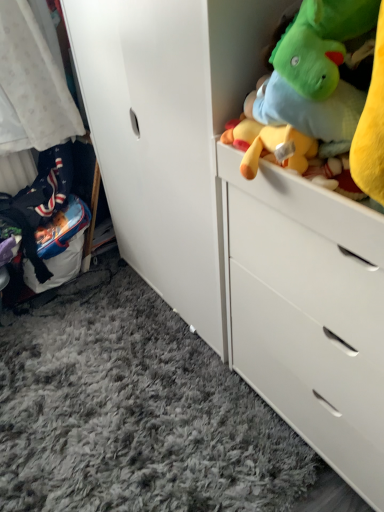
Question: Is white soft fabric at left positioned in front of white matte chest of drawers at upper right?

Choices:
 (A) no
 (B) yes

Answer: (A)

Question: Is white soft fabric at left to the right of white matte chest of drawers at upper right from the viewer's perspective?

Choices:
 (A) no
 (B) yes

Answer: (A)

Question: Considering the relative sizes of white soft fabric at left and white matte chest of drawers at upper right in the image provided, is white soft fabric at left wider than white matte chest of drawers at upper right?

Choices:
 (A) yes
 (B) no

Answer: (B)

Question: Can you confirm if white soft fabric at left is bigger than white matte chest of drawers at upper right?

Choices:
 (A) no
 (B) yes

Answer: (A)

Question: Is white soft fabric at left smaller than white matte chest of drawers at upper right?

Choices:
 (A) no
 (B) yes

Answer: (B)

Question: From a real-world perspective, relative to white matte chest of drawers at upper right, is soft plush toys at upper right vertically above or below?

Choices:
 (A) above
 (B) below

Answer: (A)

Question: Is point (362, 154) positioned closer to the camera than point (261, 391)?

Choices:
 (A) closer
 (B) farther

Answer: (A)

Question: Considering the positions of soft plush toys at upper right and white matte chest of drawers at upper right in the image, is soft plush toys at upper right taller or shorter than white matte chest of drawers at upper right?

Choices:
 (A) tall
 (B) short

Answer: (B)

Question: Is soft plush toys at upper right spatially inside white matte chest of drawers at upper right, or outside of it?

Choices:
 (A) inside
 (B) outside

Answer: (B)

Question: Is soft plush toys at upper right spatially inside white soft fabric at left, or outside of it?

Choices:
 (A) inside
 (B) outside

Answer: (B)

Question: Is point (299, 61) closer or farther from the camera than point (1, 150)?

Choices:
 (A) closer
 (B) farther

Answer: (A)

Question: Looking at the image, does soft plush toys at upper right seem bigger or smaller compared to white soft fabric at left?

Choices:
 (A) big
 (B) small

Answer: (A)

Question: From a real-world perspective, is soft plush toys at upper right above or below white soft fabric at left?

Choices:
 (A) above
 (B) below

Answer: (A)

Question: Based on their sizes in the image, would you say white matte chest of drawers at upper right is bigger or smaller than soft plush toys at upper right?

Choices:
 (A) big
 (B) small

Answer: (A)

Question: Is white matte chest of drawers at upper right in front of or behind soft plush toys at upper right in the image?

Choices:
 (A) behind
 (B) front

Answer: (A)